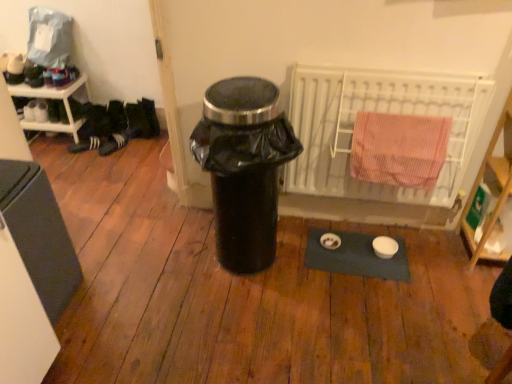
I want to click on empty space that is in between wooden shelf at right, which is counted as the 2th shelf, starting from the left, and black plastic trash can at center, so click(x=372, y=254).